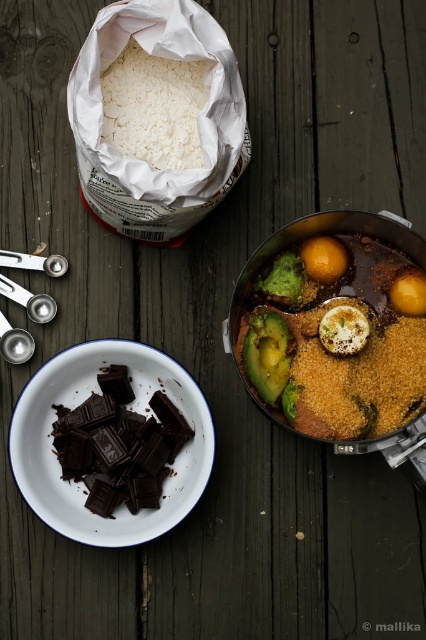
Question: Observing the image, what is the correct spatial positioning of dark chocolate chunks at bottom left in reference to white smooth egg at center?

Choices:
 (A) above
 (B) below

Answer: (B)

Question: Can you confirm if brushed metal measuring spoon at lower left is thinner than brushed metal spoon at lower left?

Choices:
 (A) no
 (B) yes

Answer: (A)

Question: Which point is farther to the camera?

Choices:
 (A) (x=173, y=80)
 (B) (x=348, y=316)

Answer: (A)

Question: Does glossy yellow egg at center right have a larger size compared to brushed metal spoon at lower left?

Choices:
 (A) yes
 (B) no

Answer: (A)

Question: Which point appears closest to the camera in this image?

Choices:
 (A) (20, 349)
 (B) (328, 250)

Answer: (B)

Question: Estimate the real-world distances between objects in this image. Which object is closer to the green matte broccoli at center?

Choices:
 (A) white powdery rice at upper left
 (B) shiny brown avocado at center

Answer: (B)